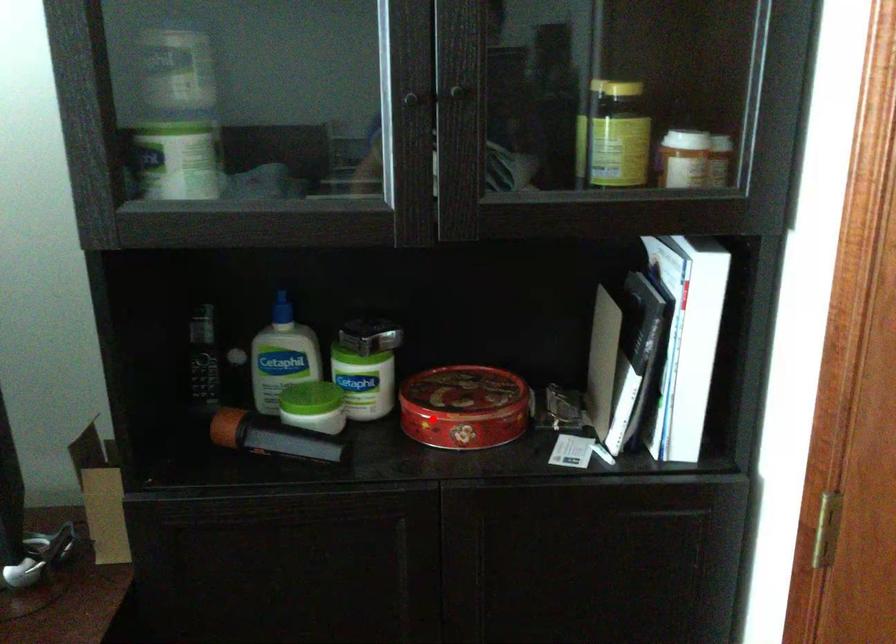
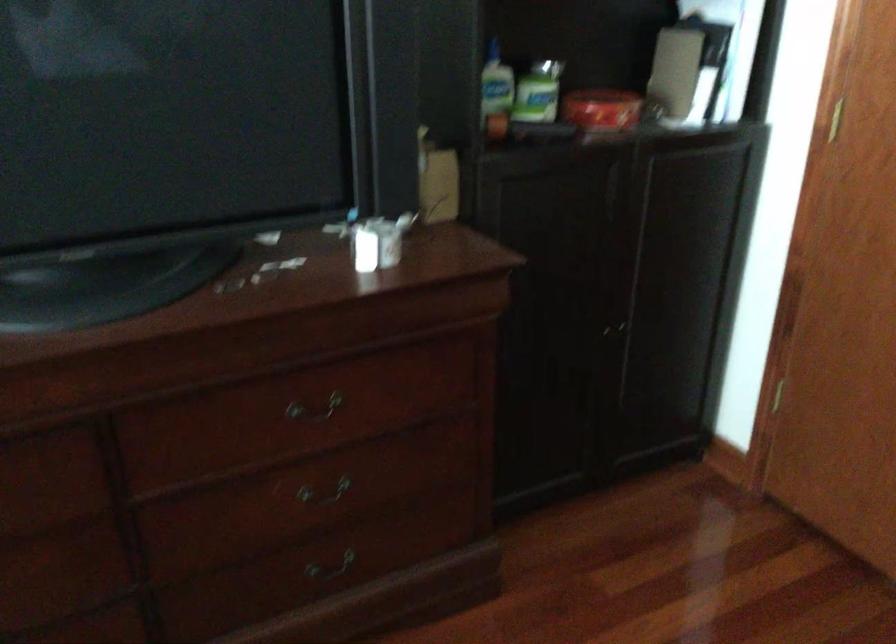
Question: A red point is marked in image1. In image2, is the corresponding 3D point closer to the camera or farther? Reply with the corresponding letter.

Choices:
 (A) The corresponding 3D point is closer.
 (B) The corresponding 3D point is farther.

Answer: (B)